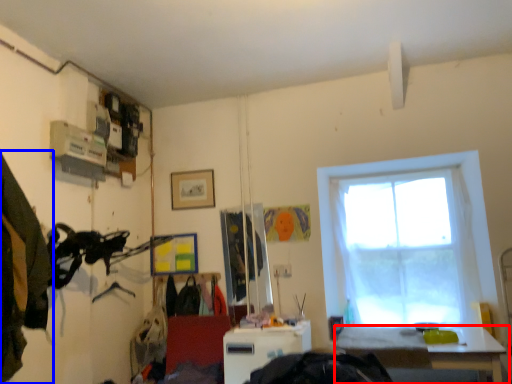
Question: Among these objects, which one is farthest to the camera, table (highlighted by a red box) or clothing (highlighted by a blue box)?

Choices:
 (A) table
 (B) clothing

Answer: (A)